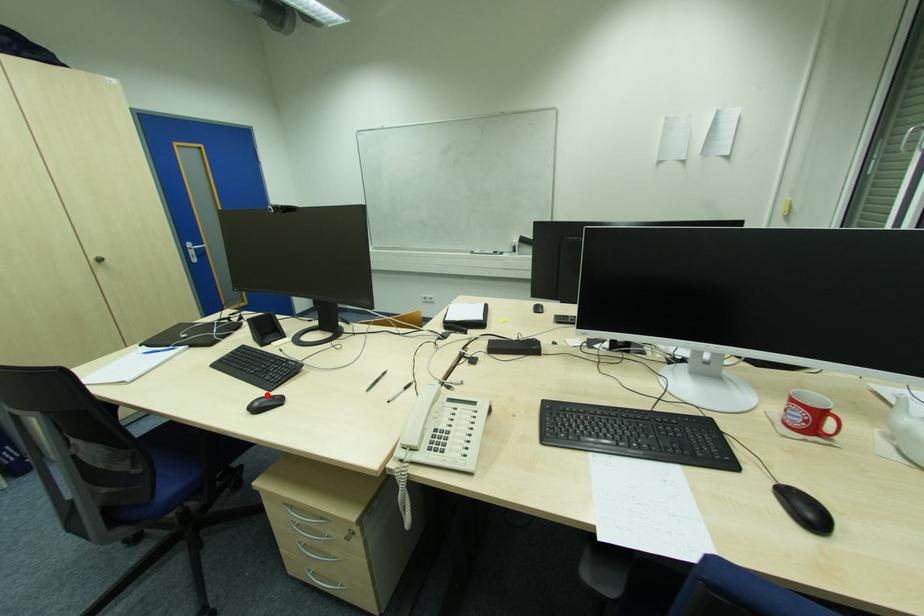
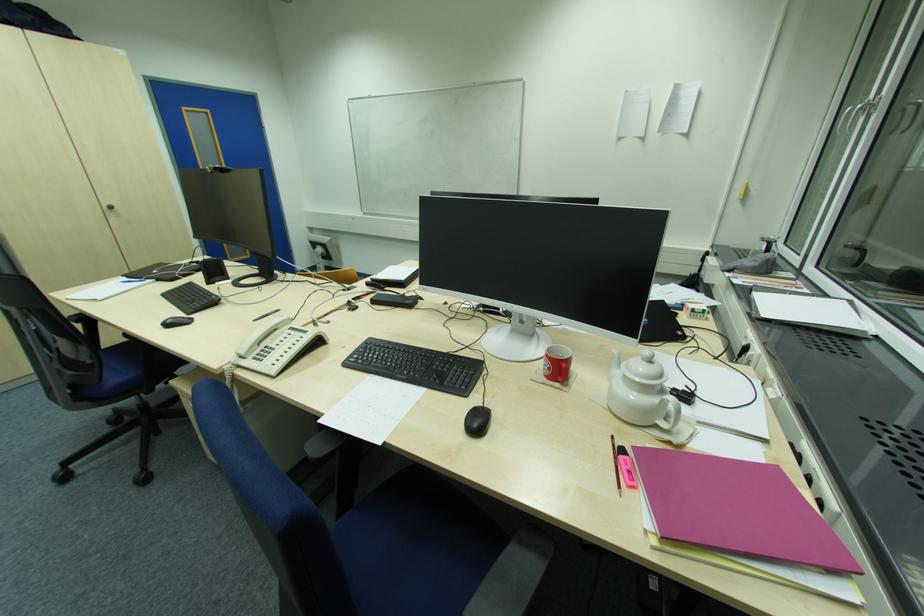
Locate, in the second image, the point that corresponds to the highlighted location in the first image.

(185, 317)